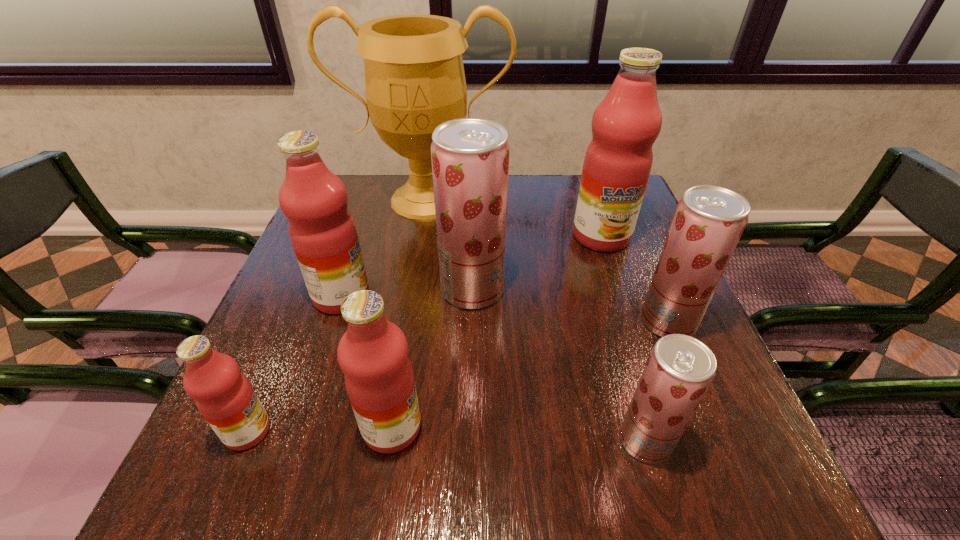
Find the location of a particular element. The height and width of the screenshot is (540, 960). empty space between the trophy and the smallest pink fruit juice is located at coordinates (337, 315).

You are a GUI agent. You are given a task and a screenshot of the screen. Output one action in this format:
    pyautogui.click(x=<x>, y=<y>)
    Task: Click on the object identified as the closest to the smallest pink fruit juice
    The width and height of the screenshot is (960, 540).
    Given the screenshot: What is the action you would take?
    pyautogui.click(x=373, y=353)

Choose which object is the fifth nearest neighbor to the smallest pink fruit juice. Please provide its 2D coordinates. Your answer should be formatted as a tuple, i.e. [(x, y)], where the tuple contains the x and y coordinates of a point satisfying the conditions above.

[(679, 370)]

Identify which fruit juice is the third closest to the second biggest pink fruit juice. Please provide its 2D coordinates. Your answer should be formatted as a tuple, i.e. [(x, y)], where the tuple contains the x and y coordinates of a point satisfying the conditions above.

[(223, 395)]

You are a GUI agent. You are given a task and a screenshot of the screen. Output one action in this format:
    pyautogui.click(x=<x>, y=<y>)
    Task: Click on the second closest fruit juice to the second pink fruit juice from right to left
    The image size is (960, 540).
    Given the screenshot: What is the action you would take?
    pyautogui.click(x=322, y=231)

Choose which pink fruit juice is the fourth nearest neighbor to the fourth fruit juice from right to left. Please provide its 2D coordinates. Your answer should be formatted as a tuple, i.e. [(x, y)], where the tuple contains the x and y coordinates of a point satisfying the conditions above.

[(223, 395)]

Identify the location of pink fruit juice that is the third nearest to the third biggest pink fruit juice. This screenshot has height=540, width=960. pyautogui.click(x=617, y=164).

Point out which strawberry fruit juice is positioned as the second nearest to the trophy. Please provide its 2D coordinates. Your answer should be formatted as a tuple, i.e. [(x, y)], where the tuple contains the x and y coordinates of a point satisfying the conditions above.

[(709, 220)]

Where is `strawberry fruit juice that is the second nearest to the second farthest pink fruit juice`? strawberry fruit juice that is the second nearest to the second farthest pink fruit juice is located at coordinates (679, 370).

This screenshot has height=540, width=960. In order to click on free region that satisfies the following two spatial constraints: 1. on the engravings side of the trophy; 2. on the label of the smallest pink fruit juice in this screenshot , I will do `click(388, 431)`.